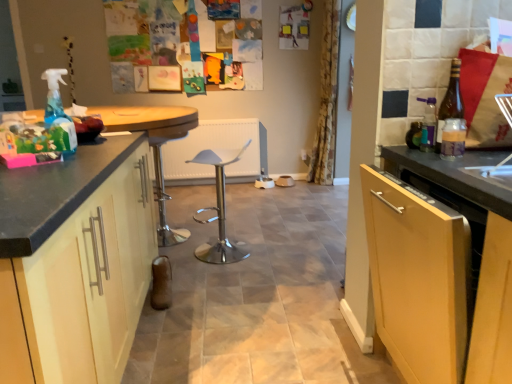
Identify the location of vacant area that lies between yellow floral fabric curtain at center and polished chrome bar stool at center, placed as the 2th bar stool when sorted from right to left. (252, 208).